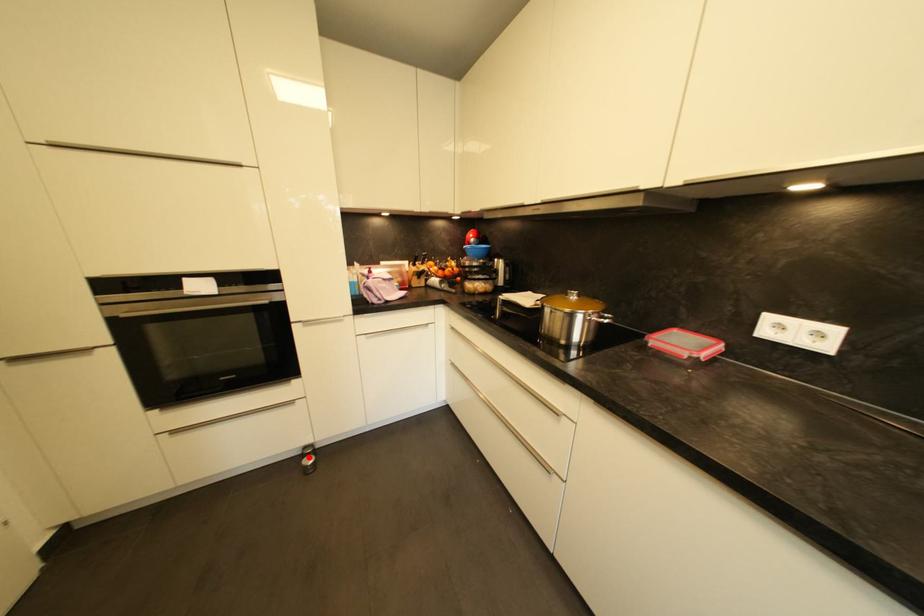
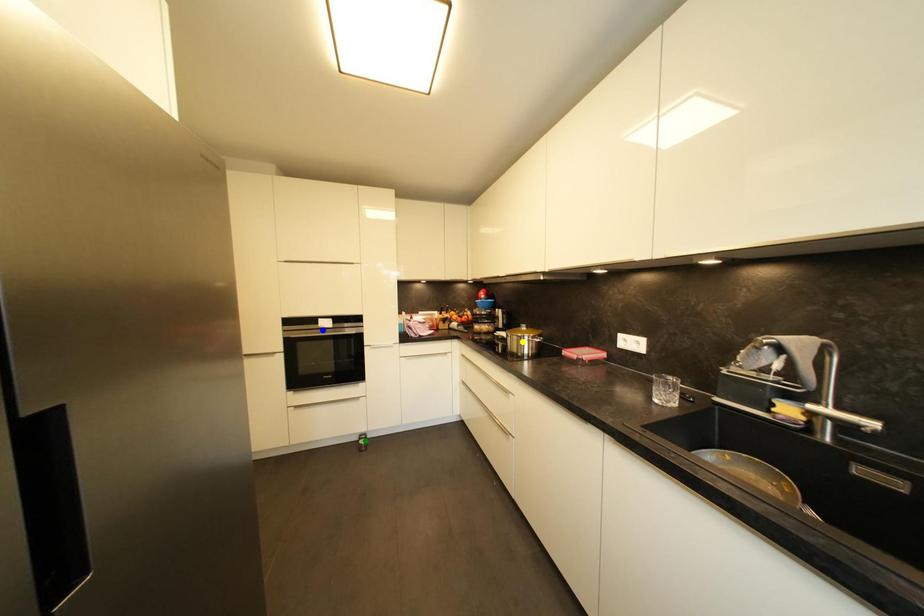
Question: I am providing you with two images of the same scene from different viewpoints. A red point is marked on the first image. You are given multiple points on the second image. Which spot in image 2 lines up with the point in image 1?

Choices:
 (A) green point
 (B) yellow point
 (C) blue point

Answer: (A)